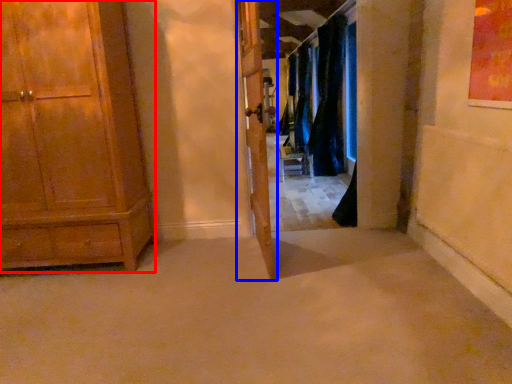
Question: Which point is further to the camera, cabinetry (highlighted by a red box) or door (highlighted by a blue box)?

Choices:
 (A) cabinetry
 (B) door

Answer: (A)